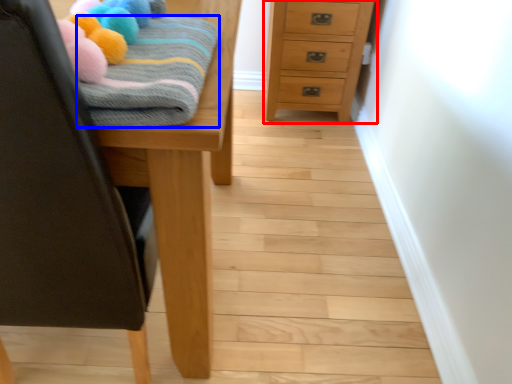
Question: Which object appears farthest to the camera in this image, chest of drawers (highlighted by a red box) or bath towel (highlighted by a blue box)?

Choices:
 (A) chest of drawers
 (B) bath towel

Answer: (A)